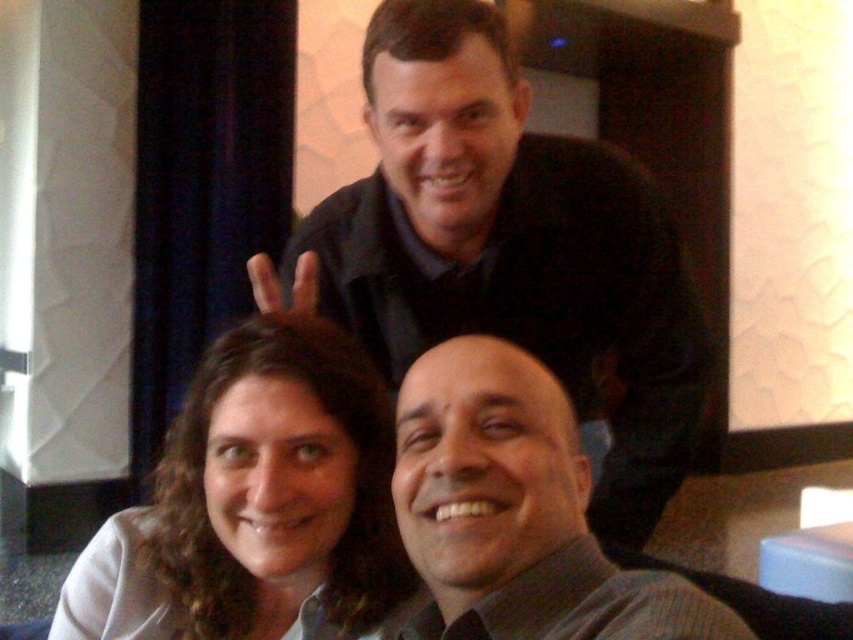
Question: Estimate the real-world distances between objects in this image. Which object is farther from the curly brown hair at lower left?

Choices:
 (A) matte gray shirt at center
 (B) matte black hand at upper center
 (C) matte black jacket at upper center

Answer: (C)

Question: From the image, what is the correct spatial relationship of matte gray shirt at center in relation to matte black hand at upper center?

Choices:
 (A) left
 (B) right

Answer: (B)

Question: Which of these objects is positioned farthest from the matte black jacket at upper center?

Choices:
 (A) curly brown hair at lower left
 (B) matte black hand at upper center
 (C) matte gray shirt at center

Answer: (C)

Question: Which of the following is the farthest from the observer?

Choices:
 (A) (461, 589)
 (B) (461, 232)

Answer: (B)

Question: Does matte black jacket at upper center have a larger size compared to matte gray shirt at center?

Choices:
 (A) no
 (B) yes

Answer: (B)

Question: Can you confirm if curly brown hair at lower left is bigger than matte gray shirt at center?

Choices:
 (A) yes
 (B) no

Answer: (A)